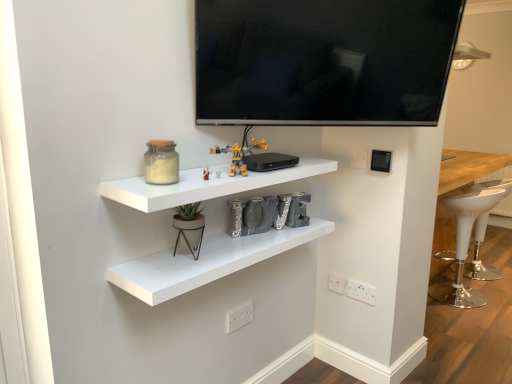
The width and height of the screenshot is (512, 384). I want to click on empty space that is to the right of matte white pot at center, the third toy from the right, so click(229, 246).